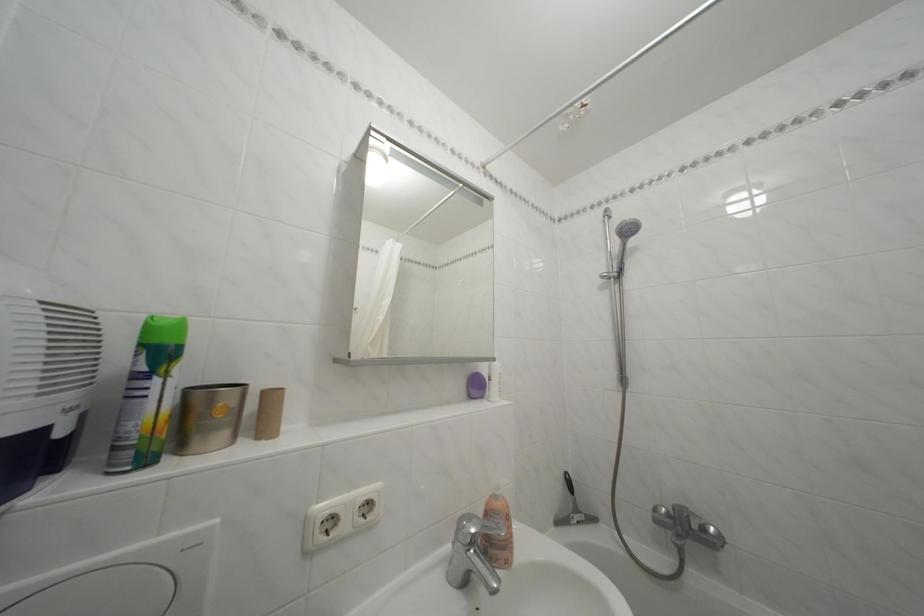
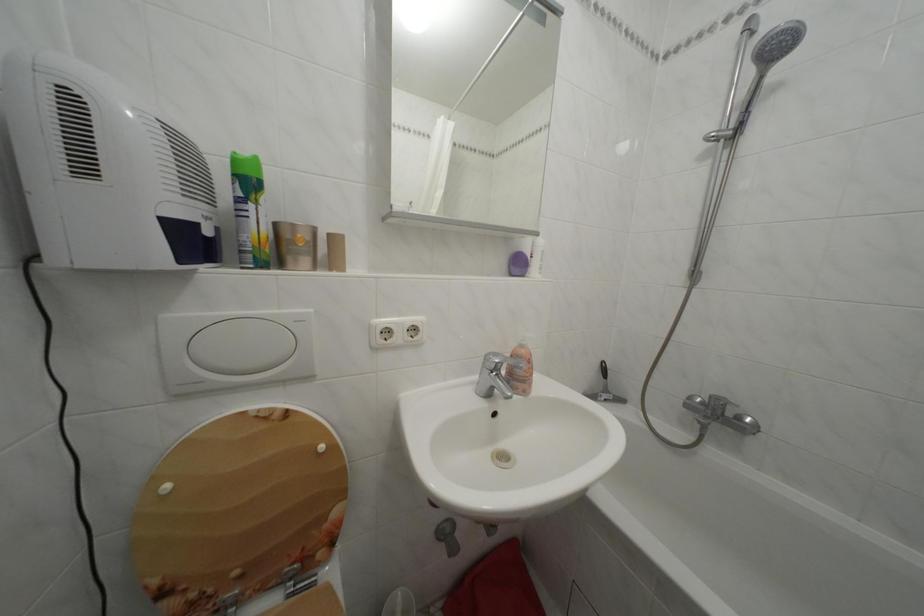
What movement of the cameraman would produce the second image?

The cameraman moved toward right, backward.